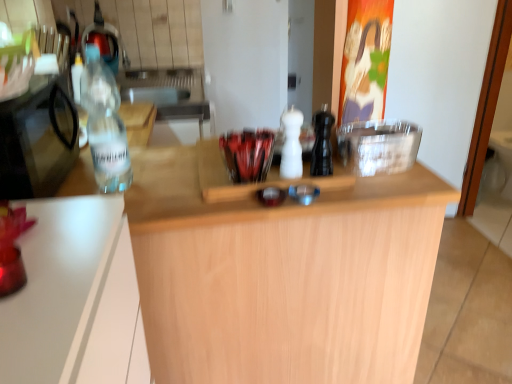
The image size is (512, 384). What are the coordinates of `free point to the left of clear glass bottle at left, the first bottle in the left-to-right sequence` in the screenshot? It's located at (67, 179).